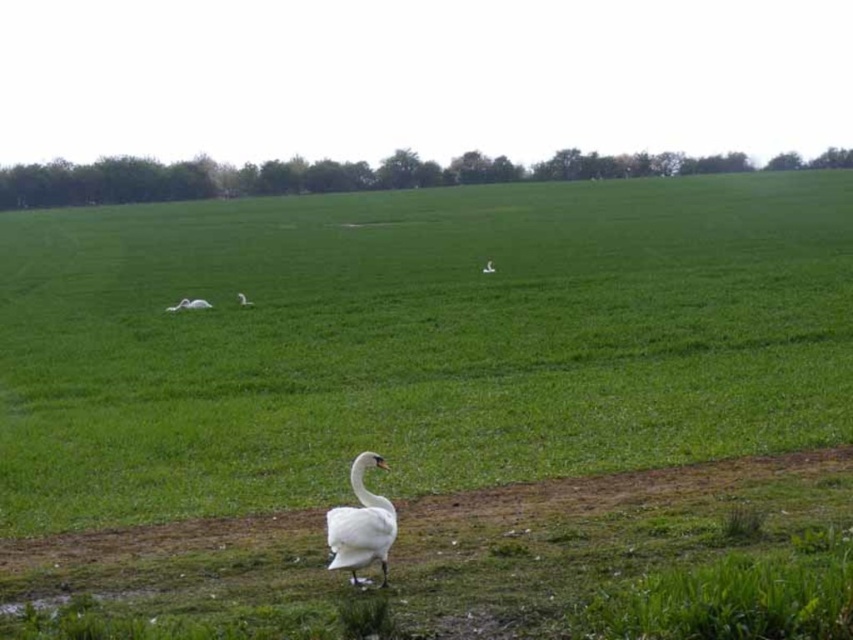
You are a photographer trying to capture the white feathered swan at center. You notice the green grass at center is blocking your view. Is the swan visible behind the grass?

The green grass at center is in front of the white feathered swan at center, so the swan may be partially or fully obscured depending on the grass height and camera angle.

You are a landscape architect designing a new park. You want to place a statue of the white matte swan at center in the green grass at center. Based on the scene, will the swan statue fit comfortably in the grass area without overcrowding it?

The green grass at center has a larger size compared to the white matte swan at center, so the swan statue will fit comfortably in the grass area without overcrowding it.

You are a landscape architect designing a new park. You want to ensure that the green grass at center and the white matte swan at center are visible from a distance. Considering their widths, which one is wider and thus more likely to be noticed first?

The green grass at center is wider than the white matte swan at center, so it will be more noticeable from a distance.